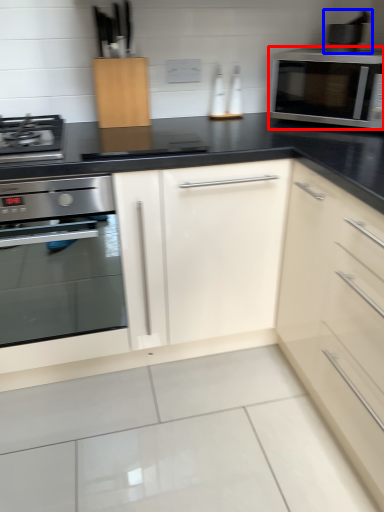
Question: Which object is closer to the camera taking this photo, microwave oven (highlighted by a red box) or appliance (highlighted by a blue box)?

Choices:
 (A) microwave oven
 (B) appliance

Answer: (A)